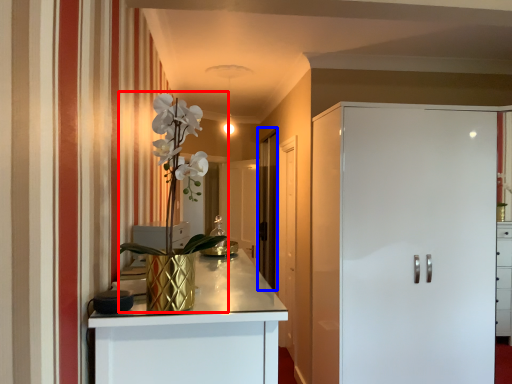
Question: Which object is closer to the camera taking this photo, floral arrangement (highlighted by a red box) or glass door (highlighted by a blue box)?

Choices:
 (A) floral arrangement
 (B) glass door

Answer: (A)